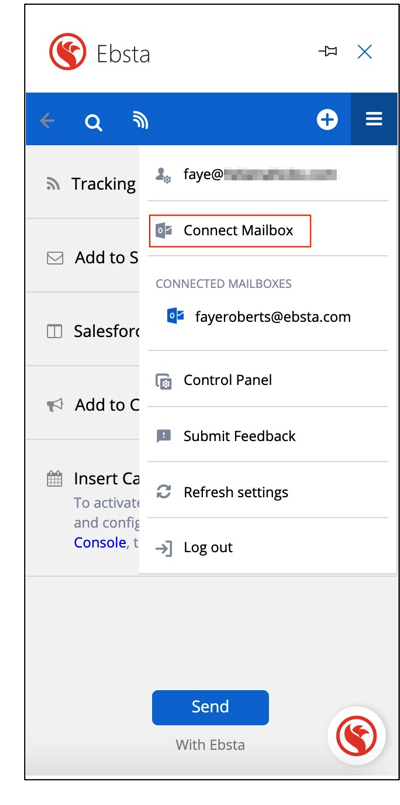
At what (x,y) coordinates should I click in order to perform the action: click on control panel. Please return your answer as a coordinate pair (x, y). This screenshot has width=400, height=805. Looking at the image, I should click on (213, 381).